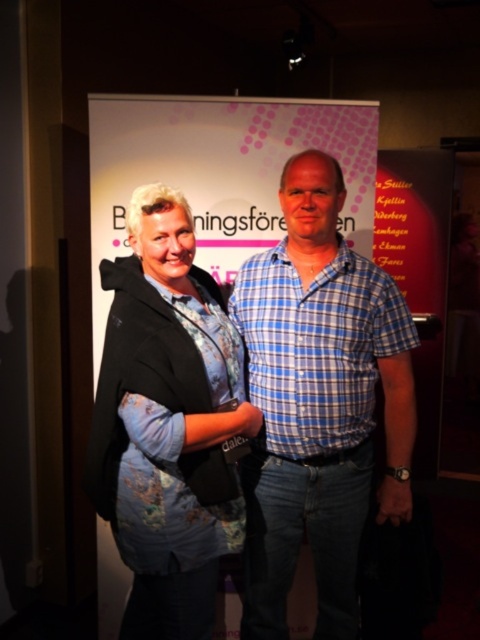
You are organizing a photo shoot and need to ensure that all clothing items are visible. Given the blue plaid shirt at center and the floral fabric blouse at center, which clothing item is more likely to be fully visible in the photo?

The blue plaid shirt at center is more likely to be fully visible because it occupies less space than the floral fabric blouse at center, making it easier to capture in the frame without obstruction.

You are a photographer at the event and need to ensure both the blue plaid shirt at center and the floral fabric blouse at center are visible in the photo. Which clothing item is taller and might require adjusting the camera angle to fully capture?

The blue plaid shirt at center is taller than the floral fabric blouse at center, so adjusting the camera angle to account for its height would ensure both are fully visible.

You are at a conference and want to take a photo of both the blue plaid shirt at center and the floral fabric blouse at center. Which one should you focus on first to ensure both are in focus?

You should focus on the blue plaid shirt at center first since it is closer to you than the floral fabric blouse at center, ensuring both will be in focus when using depth of field appropriately.